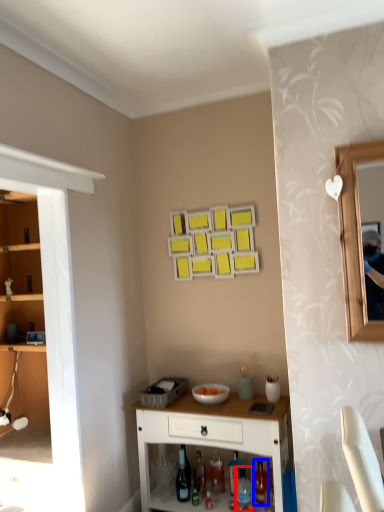
Question: Among these objects, which one is nearest to the camera, bottle (highlighted by a red box) or bottle (highlighted by a blue box)?

Choices:
 (A) bottle
 (B) bottle

Answer: (A)